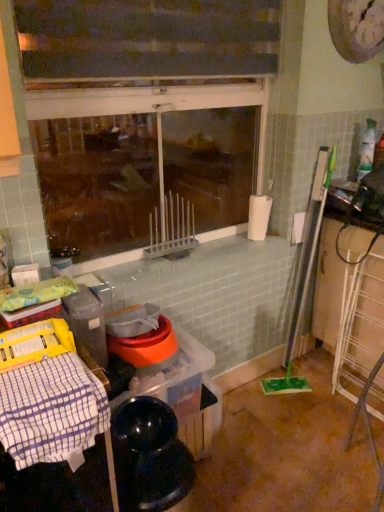
Question: Considering the positions of transparent glass window at center and white checkered cloth at lower left in the image, is transparent glass window at center taller or shorter than white checkered cloth at lower left?

Choices:
 (A) tall
 (B) short

Answer: (A)

Question: In terms of width, does transparent glass window at center look wider or thinner when compared to white checkered cloth at lower left?

Choices:
 (A) wide
 (B) thin

Answer: (B)

Question: Is transparent glass window at center inside the boundaries of white checkered cloth at lower left, or outside?

Choices:
 (A) outside
 (B) inside

Answer: (A)

Question: In terms of height, does white checkered cloth at lower left look taller or shorter compared to transparent glass window at center?

Choices:
 (A) tall
 (B) short

Answer: (B)

Question: In terms of width, does white checkered cloth at lower left look wider or thinner when compared to transparent glass window at center?

Choices:
 (A) thin
 (B) wide

Answer: (B)

Question: From the image's perspective, relative to transparent glass window at center, is white checkered cloth at lower left above or below?

Choices:
 (A) below
 (B) above

Answer: (A)

Question: Considering the relative positions of white checkered cloth at lower left and transparent glass window at center in the image provided, is white checkered cloth at lower left to the left or to the right of transparent glass window at center?

Choices:
 (A) left
 (B) right

Answer: (A)